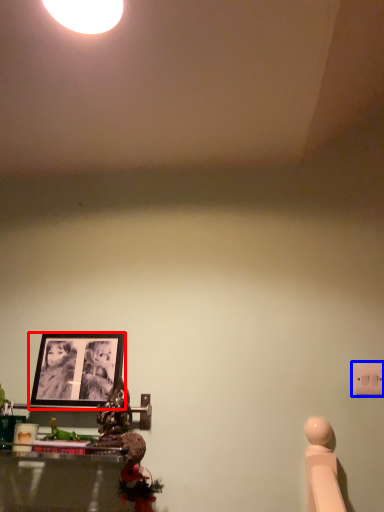
Question: Which point is further to the camera, picture frame (highlighted by a red box) or light switch (highlighted by a blue box)?

Choices:
 (A) picture frame
 (B) light switch

Answer: (A)